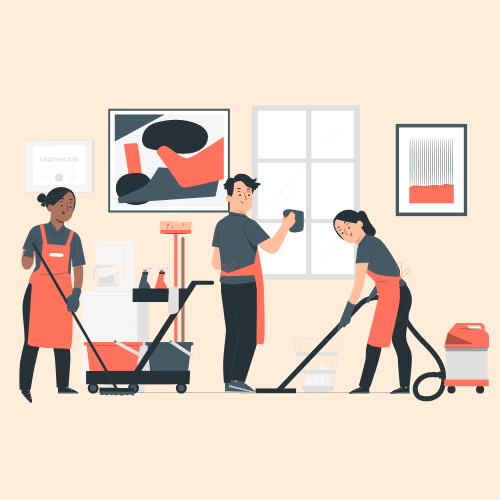
Find the location of a particular element. This screenshot has width=500, height=500. wall is located at coordinates (422, 265).